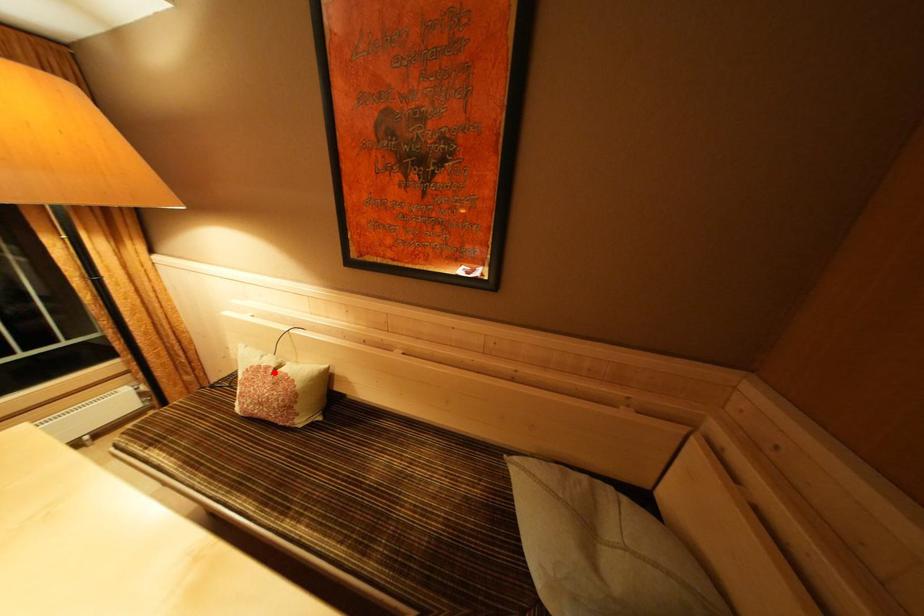
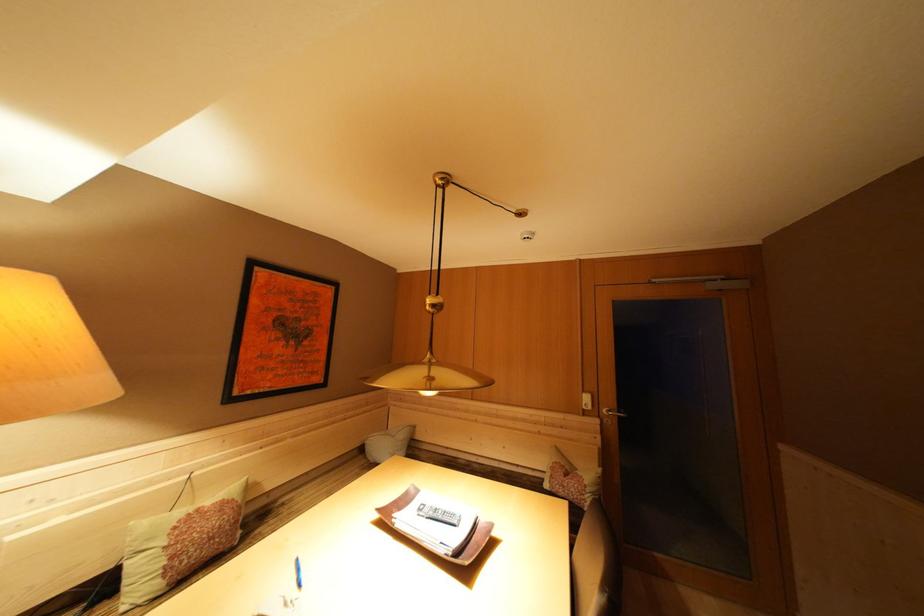
In the second image, find the point that corresponds to the highlighted location in the first image.

(204, 515)